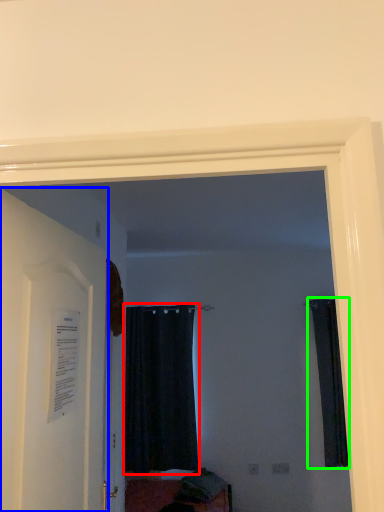
Question: Considering the real-world distances, which object is closest to curtain (highlighted by a red box)? door (highlighted by a blue box) or curtain (highlighted by a green box).

Choices:
 (A) door
 (B) curtain

Answer: (B)